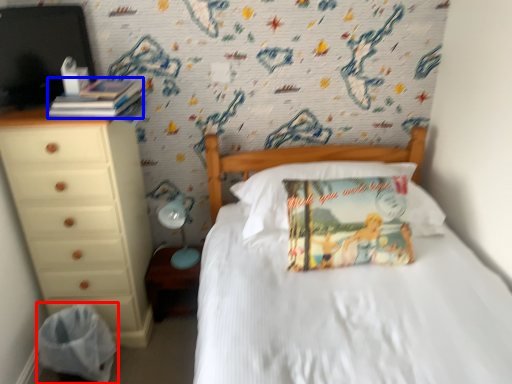
Question: Which point is closer to the camera, material (highlighted by a red box) or book (highlighted by a blue box)?

Choices:
 (A) material
 (B) book

Answer: (B)